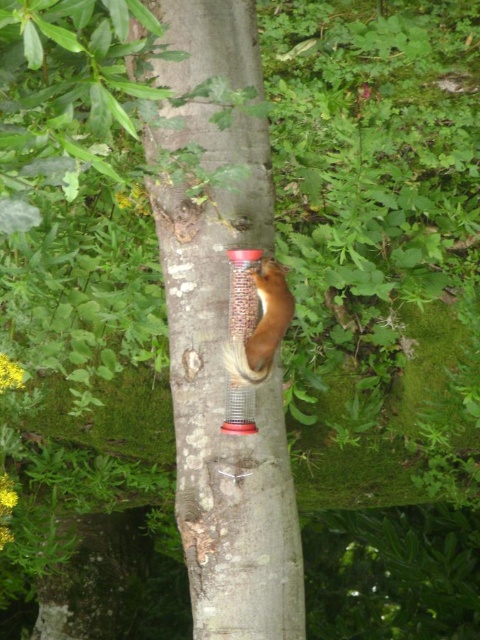
You are a photographer standing in front of the smooth bark tree trunk at center. You want to take a photo of the transparent plastic bird feeder at center. Which object is closer to your camera lens?

The smooth bark tree trunk at center is closer to the viewer than the transparent plastic bird feeder at center, so the tree trunk will appear closer to the camera lens in the photo.

You are standing in front of the tree trunk and want to place a small red bird feeder at point (224,387). According to the scene description, what is present at that location?

The smooth bark tree trunk at center is present at point (224,387).